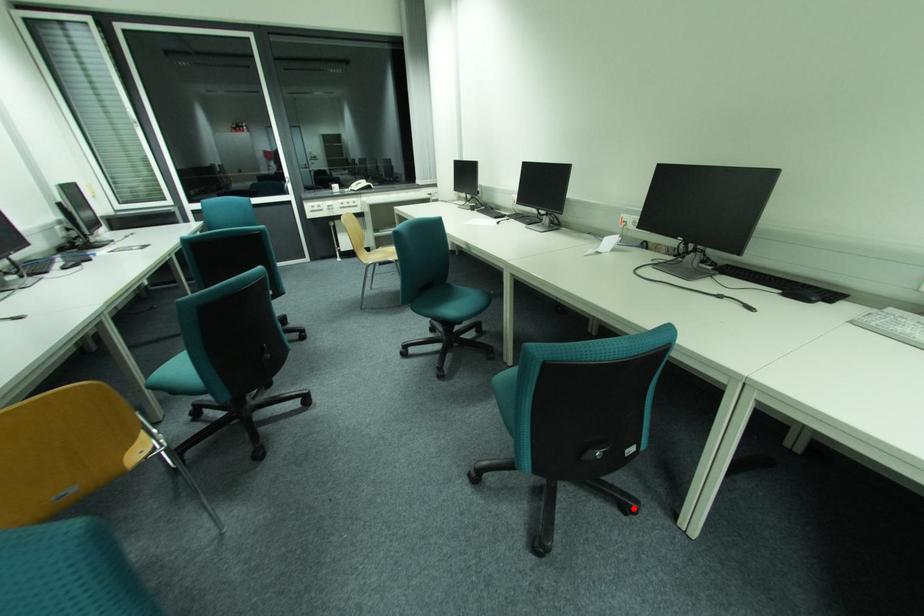
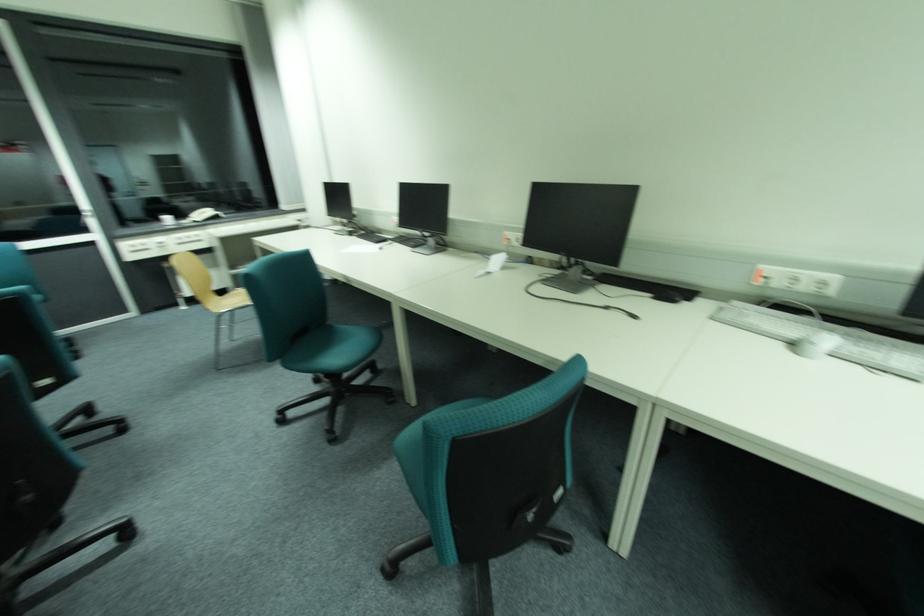
Where in the second image is the point corresponding to the highlighted location from the first image?

(568, 551)